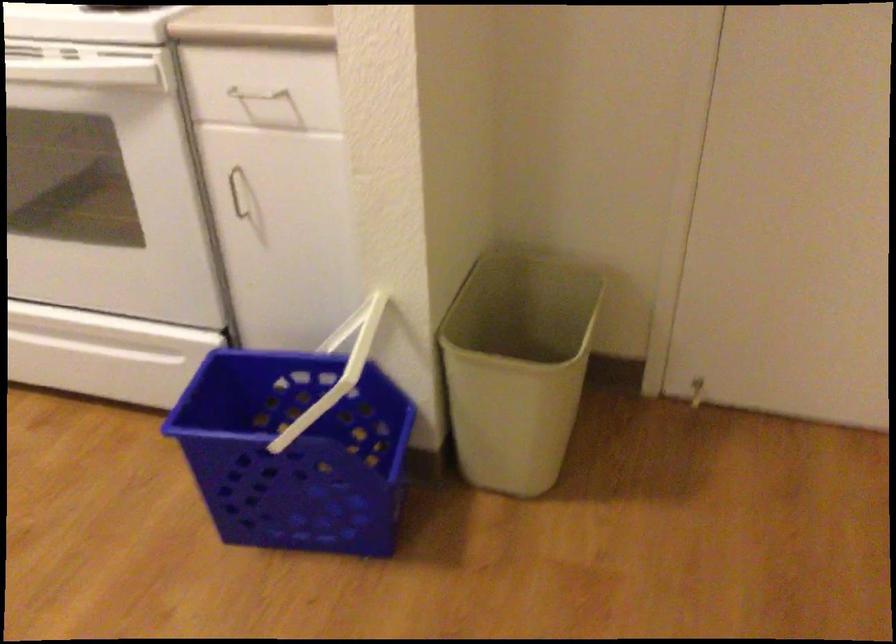
This screenshot has height=644, width=896. What do you see at coordinates (517, 366) in the screenshot?
I see `a beige trash can` at bounding box center [517, 366].